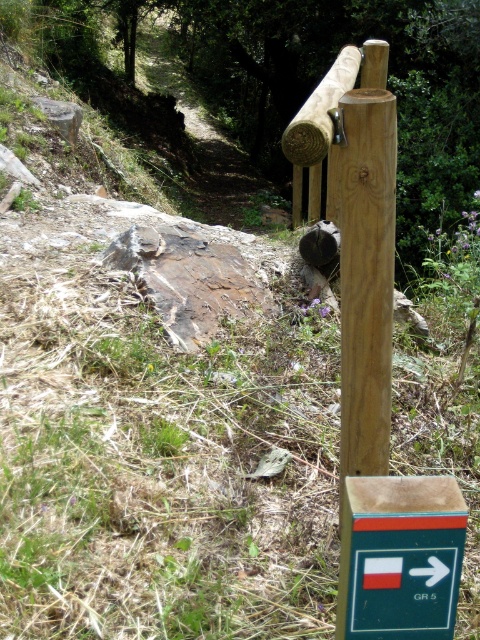
You are standing at the wooden post with the GR 5 sign and want to walk towards the two points marked in the image. Which point, point (368, 556) or point (299, 161), will you reach first?

You will reach point (368, 556) first because it is closer to the viewer than point (299, 161).